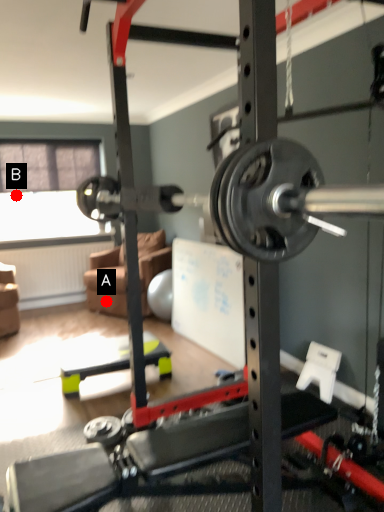
Question: Two points are circled on the image, labeled by A and B beside each circle. Which of the following is the closest to the observer?

Choices:
 (A) A is closer
 (B) B is closer

Answer: (A)